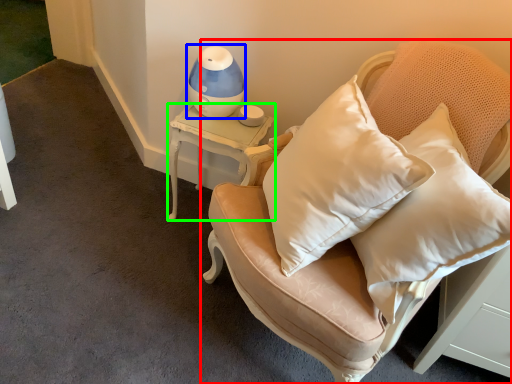
Question: Which object is positioned closest to furniture (highlighted by a red box)? Select from table lamp (highlighted by a blue box) and table (highlighted by a green box).

Choices:
 (A) table lamp
 (B) table

Answer: (B)